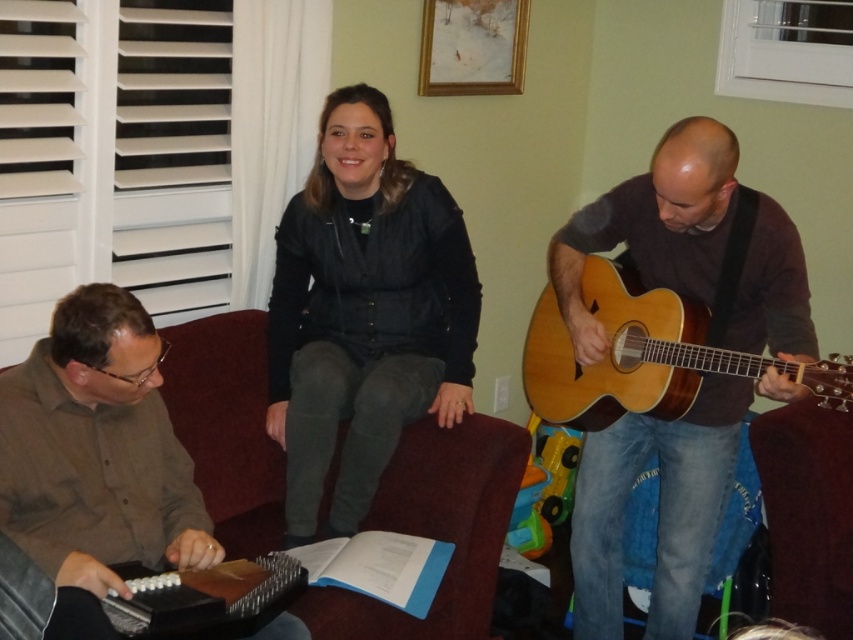
Question: Which point is closer to the camera taking this photo?

Choices:
 (A) (555, 321)
 (B) (693, 237)
 (C) (436, 300)
 (D) (157, 515)

Answer: (D)

Question: Which of the following is the closest to the observer?

Choices:
 (A) matte brown guitar at right
 (B) natural wood acoustic guitar at right
 (C) brown shirt at left

Answer: (C)

Question: Does black leather jacket at center appear on the left side of brown shirt at left?

Choices:
 (A) no
 (B) yes

Answer: (A)

Question: Is brown shirt at left further to camera compared to natural wood acoustic guitar at right?

Choices:
 (A) yes
 (B) no

Answer: (B)

Question: Which of the following is the closest to the observer?

Choices:
 (A) (85, 413)
 (B) (664, 428)
 (C) (405, 292)
 (D) (595, 417)

Answer: (A)

Question: Observing the image, what is the correct spatial positioning of black leather jacket at center in reference to brown shirt at left?

Choices:
 (A) above
 (B) below

Answer: (A)